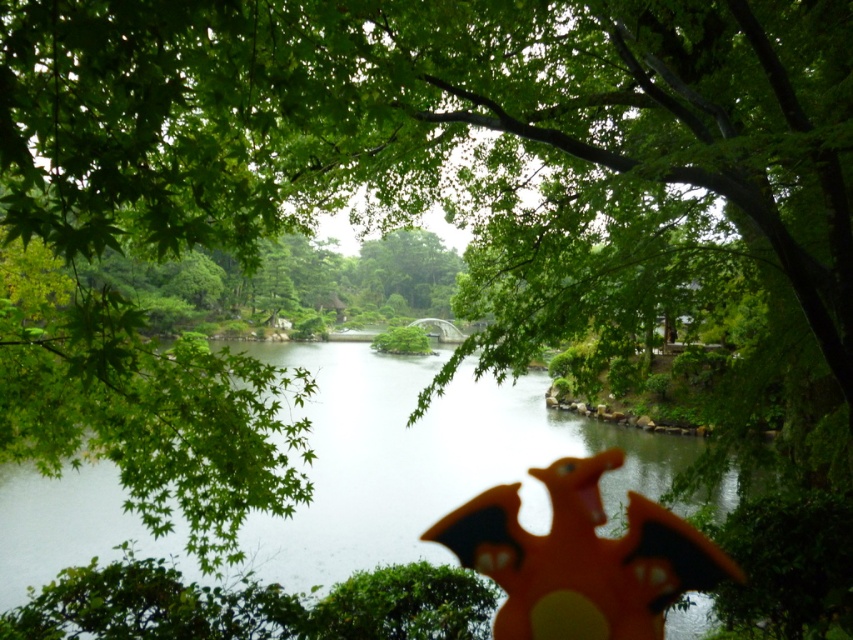
Question: Where is transparent water at center located in relation to orange matte dragon at center in the image?

Choices:
 (A) below
 (B) above

Answer: (B)

Question: Among these points, which one is farthest from the camera?

Choices:
 (A) (334, 360)
 (B) (548, 468)

Answer: (A)

Question: Does transparent water at center appear over orange matte dragon at center?

Choices:
 (A) no
 (B) yes

Answer: (B)

Question: Can you confirm if transparent water at center is positioned above orange matte dragon at center?

Choices:
 (A) no
 (B) yes

Answer: (B)

Question: Which point is closer to the camera?

Choices:
 (A) (527, 621)
 (B) (496, 388)

Answer: (A)

Question: Which of the following is the closest to the observer?

Choices:
 (A) transparent water at center
 (B) orange matte dragon at center

Answer: (A)